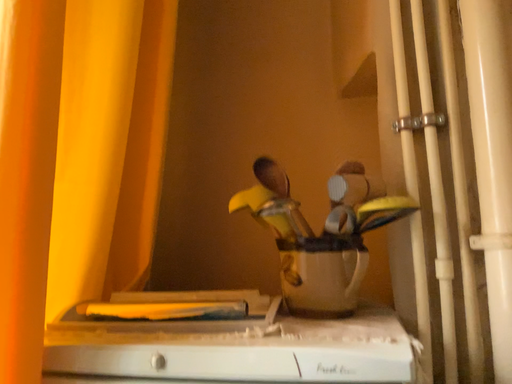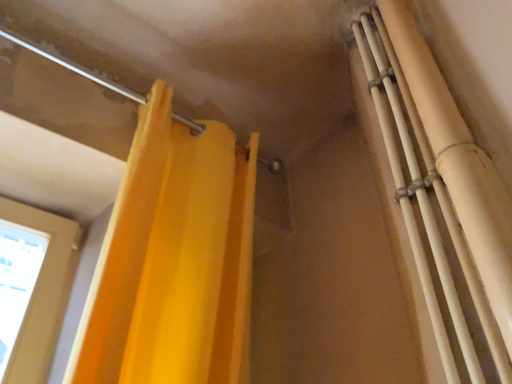
Question: How did the camera likely rotate when shooting the video?

Choices:
 (A) rotated right
 (B) rotated left

Answer: (B)